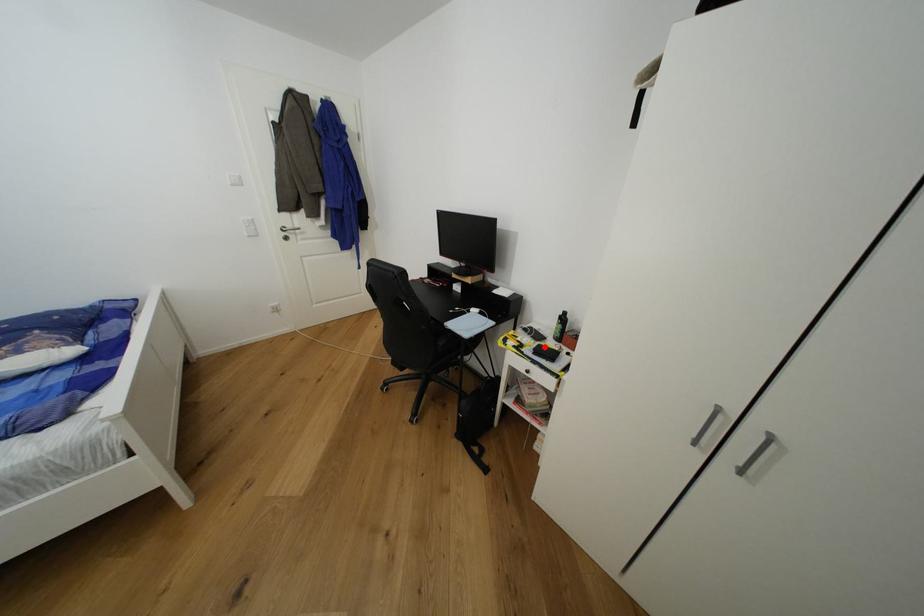
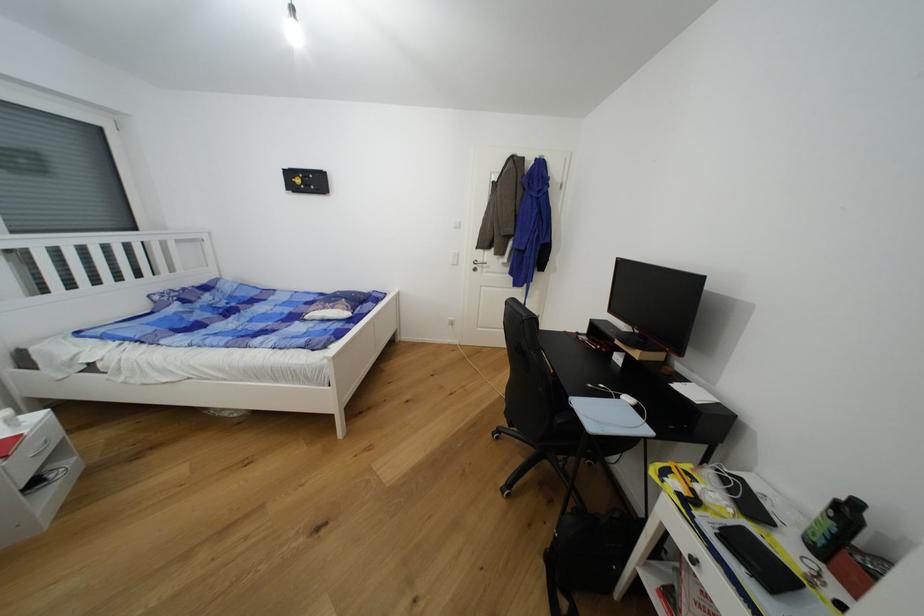
Question: I am providing you with two images of the same scene from different viewpoints. A red point is marked on the first image. Is the red point's position out of view in image 2?

Choices:
 (A) Yes
 (B) No

Answer: (B)